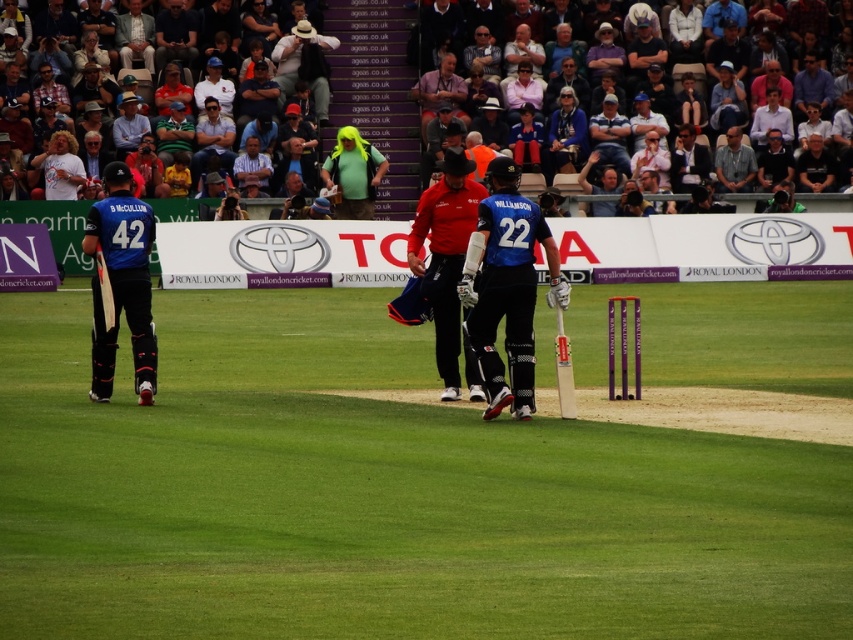
Question: Does red matte bat at center come in front of light blue shirt at upper center?

Choices:
 (A) yes
 (B) no

Answer: (A)

Question: Among these points, which one is nearest to the camera?

Choices:
 (A) (694, 80)
 (B) (604, 124)
 (C) (448, 257)

Answer: (C)

Question: Is red matte bat at center bigger than light brown leather jacket at upper center?

Choices:
 (A) no
 (B) yes

Answer: (B)

Question: Estimate the real-world distances between objects in this image. Which object is closer to the gray fabric jacket at upper right?

Choices:
 (A) red matte bat at center
 (B) light blue shirt at upper center

Answer: (B)

Question: Which point appears farthest from the camera in this image?

Choices:
 (A) (749, 154)
 (B) (695, 68)
 (C) (434, 257)

Answer: (B)

Question: Does red matte bat at center lie behind light brown leather jacket at upper center?

Choices:
 (A) no
 (B) yes

Answer: (A)